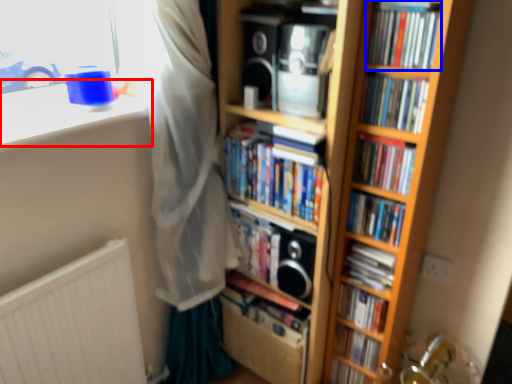
Question: Which point is closer to the camera, window sill (highlighted by a red box) or book (highlighted by a blue box)?

Choices:
 (A) window sill
 (B) book

Answer: (A)